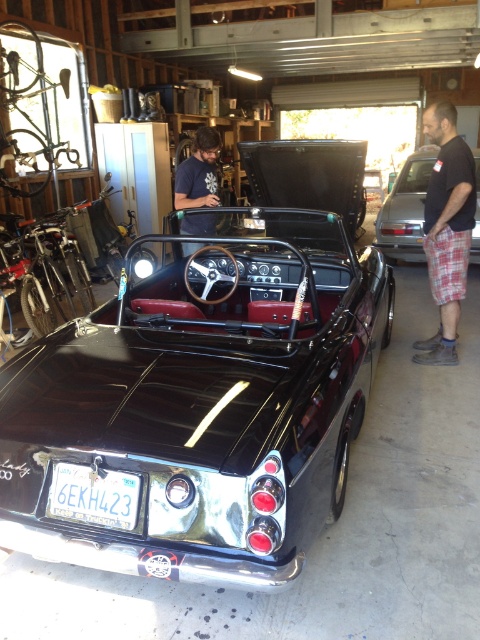
Question: Is black cotton t-shirt at right below glossy black convertible at right?

Choices:
 (A) yes
 (B) no

Answer: (A)

Question: From the image, what is the correct spatial relationship of white plastic license plate at lower center in relation to glossy black convertible at right?

Choices:
 (A) above
 (B) below

Answer: (B)

Question: Which point is closer to the camera taking this photo?

Choices:
 (A) (184, 173)
 (B) (415, 248)
 (C) (428, 260)
 (D) (122, 493)

Answer: (D)

Question: Which point is farther from the camera taking this photo?

Choices:
 (A) pyautogui.click(x=203, y=161)
 (B) pyautogui.click(x=52, y=480)
 (C) pyautogui.click(x=394, y=253)

Answer: (C)

Question: Does glossy black convertible at right come in front of dark blue t-shirt at center?

Choices:
 (A) yes
 (B) no

Answer: (B)

Question: Which point is closer to the camera?

Choices:
 (A) (412, 177)
 (B) (441, 154)

Answer: (B)